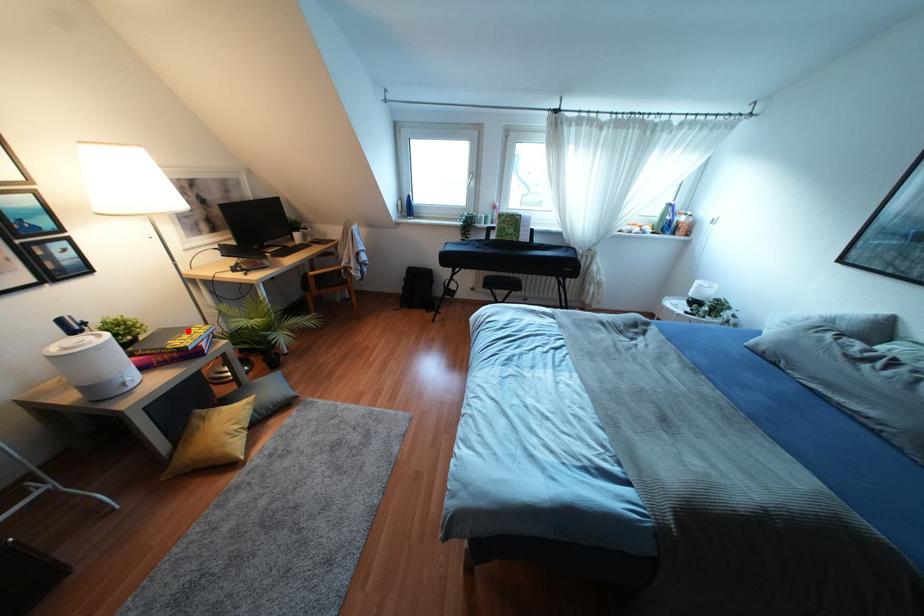
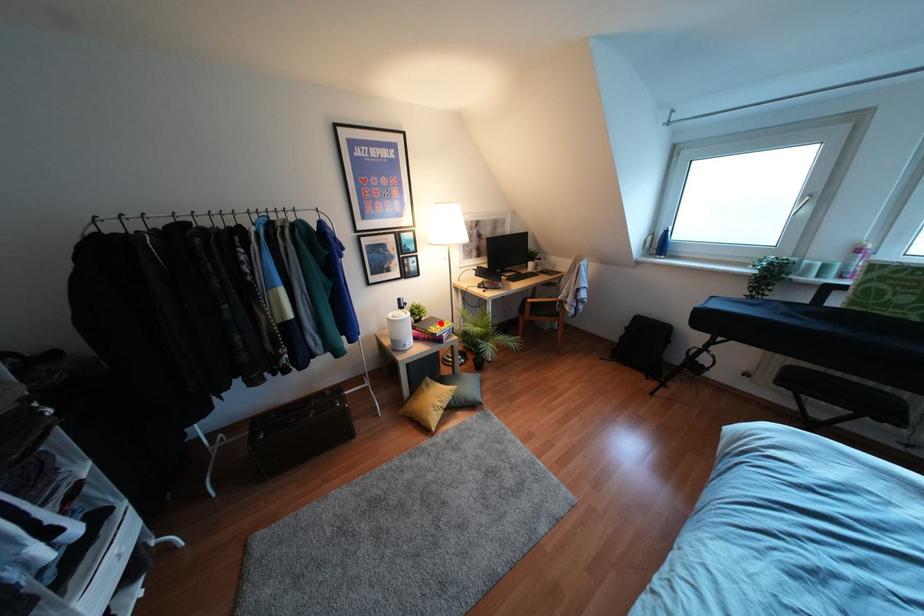
Based on the photo, I am providing you with two images of the same scene from different viewpoints. A red point is marked on the first image and another point is marked on the second image. Is the red point in image1 aligned with the point shown in image2?

Yes